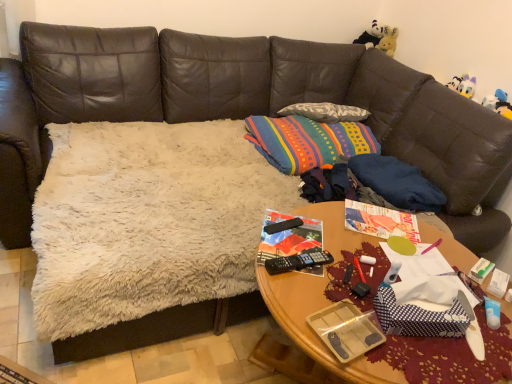
Identify the location of free space in front of black plastic remote control at center. (288, 253).